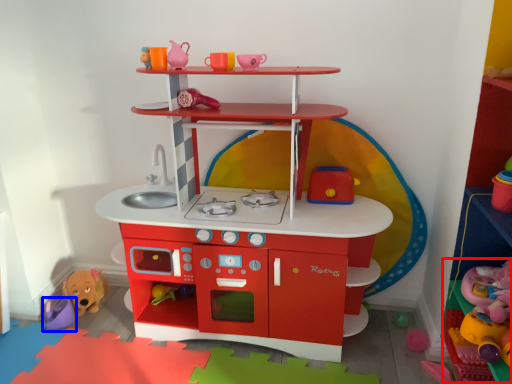
Question: Among these objects, which one is nearest to the camera, toy (highlighted by a red box) or toy (highlighted by a blue box)?

Choices:
 (A) toy
 (B) toy

Answer: (A)